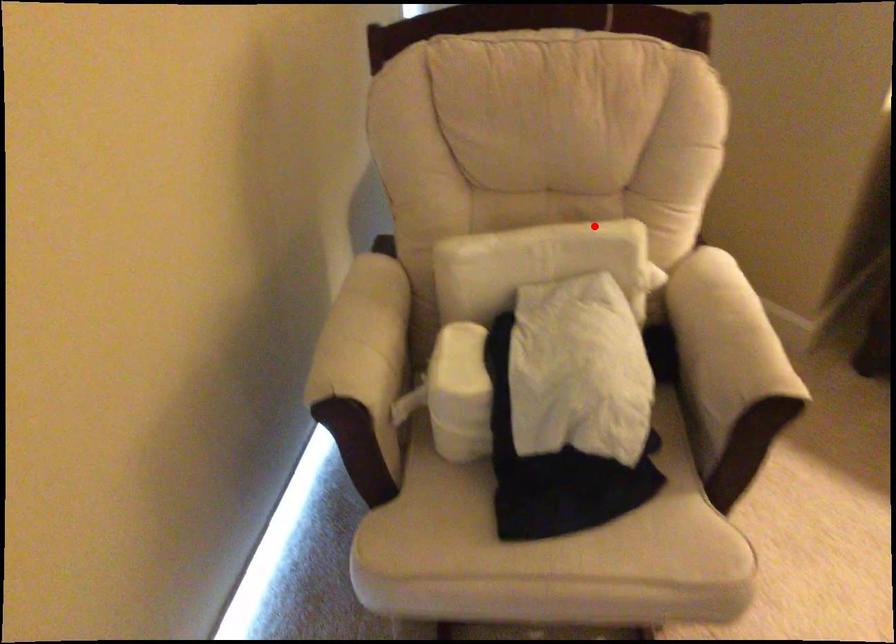
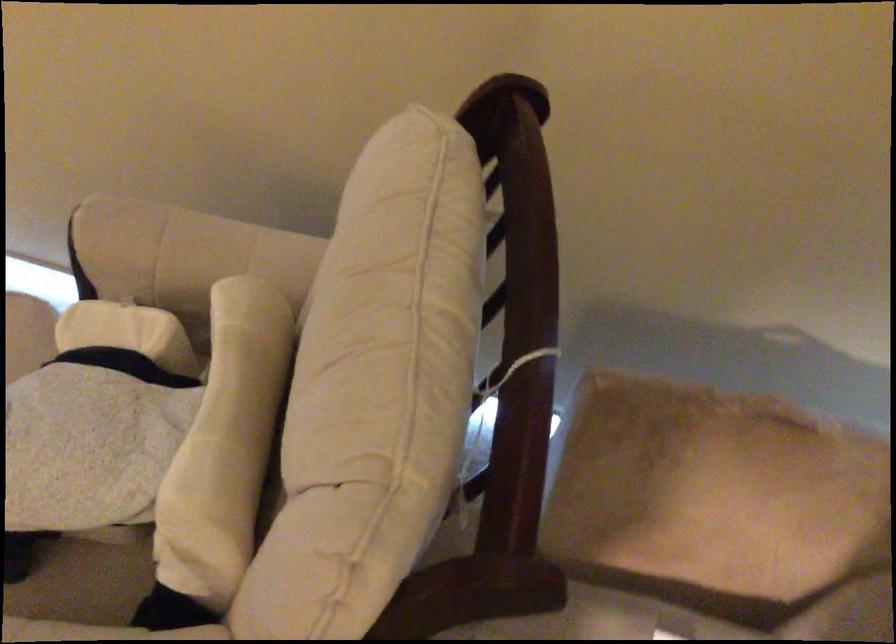
In the second image, find the point that corresponds to the highlighted location in the first image.

(225, 444)